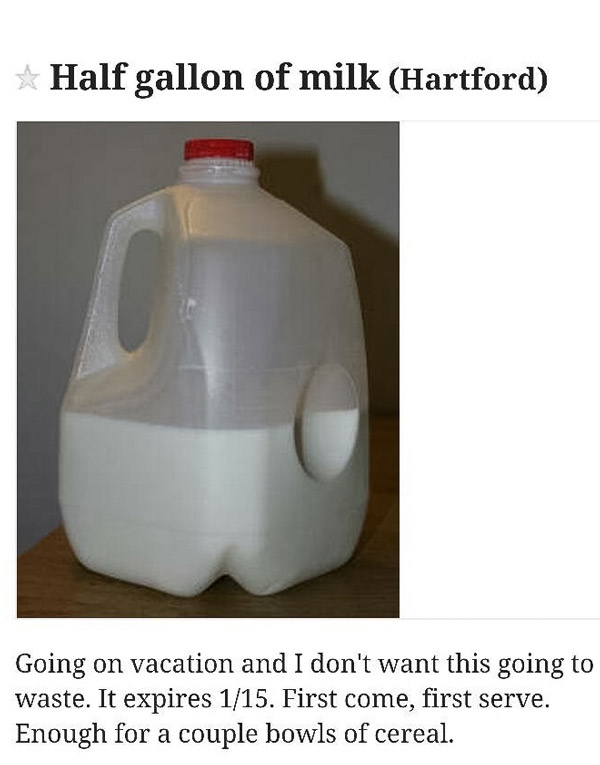
Locate an element on the screen. This screenshot has height=765, width=600. 1 handle is located at coordinates (108, 314).